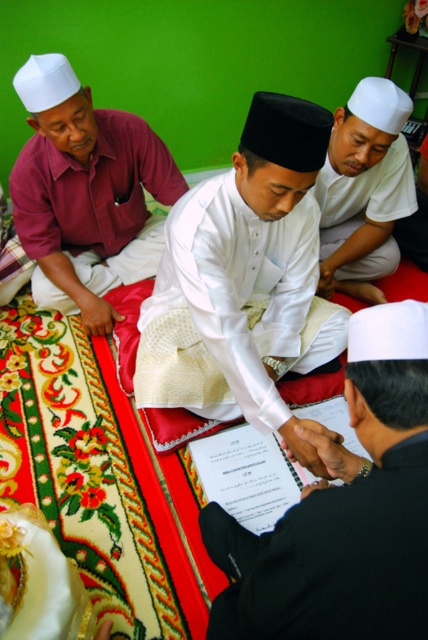
Question: Among these points, which one is nearest to the camera?

Choices:
 (A) (238, 358)
 (B) (312, 531)
 (C) (65, 99)

Answer: (B)

Question: Does black satin robe at lower right lie behind matte maroon shirt at left?

Choices:
 (A) yes
 (B) no

Answer: (B)

Question: Which of these objects is positioned farthest from the white satin shirt at center?

Choices:
 (A) black satin robe at lower right
 (B) white matte shirt at center

Answer: (B)

Question: Which point is closer to the camera?

Choices:
 (A) matte maroon shirt at left
 (B) white satin shirt at center
 (C) white matte shirt at center

Answer: (B)

Question: Is matte maroon shirt at left wider than white matte shirt at center?

Choices:
 (A) no
 (B) yes

Answer: (B)

Question: Does black satin robe at lower right lie in front of white matte shirt at center?

Choices:
 (A) no
 (B) yes

Answer: (B)